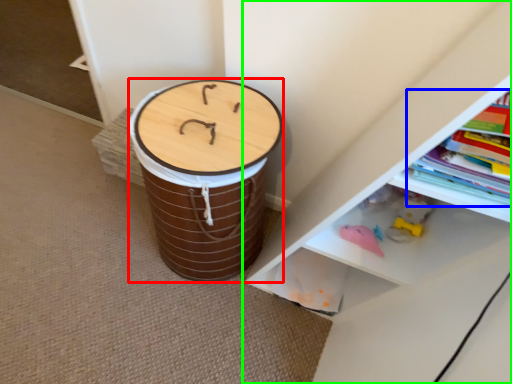
Question: Based on their relative distances, which object is farther from drum (highlighted by a red box)? Choose from book (highlighted by a blue box) and shelf (highlighted by a green box).

Choices:
 (A) book
 (B) shelf

Answer: (A)